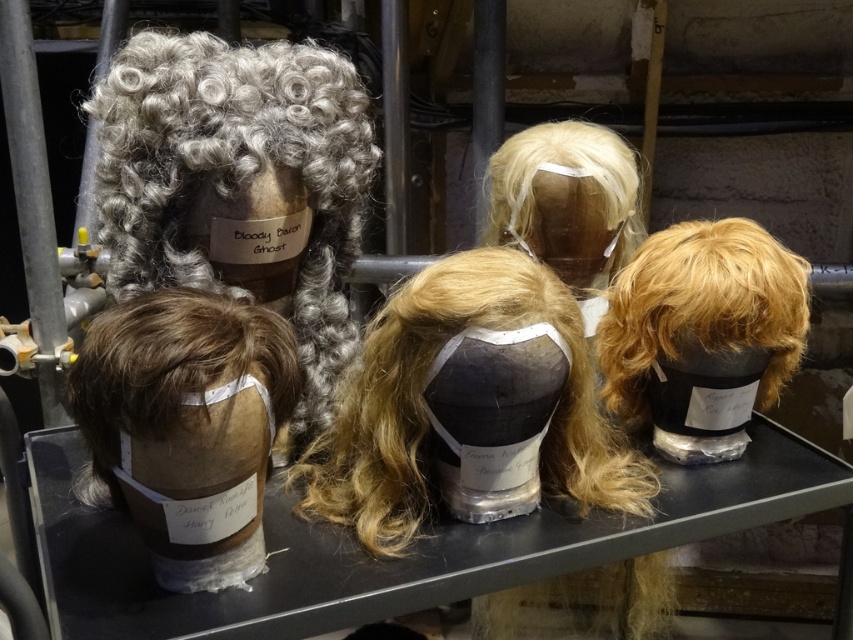
Question: Which of the following is the closest to the observer?

Choices:
 (A) (358, 397)
 (B) (120, 125)

Answer: (B)

Question: Is curly gray wig at upper left below brown fuzzy wig at lower left?

Choices:
 (A) no
 (B) yes

Answer: (A)

Question: Which point is farther to the camera?

Choices:
 (A) (276, 340)
 (B) (398, 417)
 (C) (679, 342)

Answer: (C)

Question: Which of the following is the farthest from the observer?

Choices:
 (A) blonde synthetic wig at right
 (B) blonde synthetic wig at upper center

Answer: (B)

Question: Where is blonde synthetic wig at right located in relation to blonde synthetic wig at upper center in the image?

Choices:
 (A) left
 (B) right

Answer: (B)

Question: In this image, where is brown fuzzy wig at lower left located relative to blonde synthetic wig at upper center?

Choices:
 (A) below
 (B) above

Answer: (A)